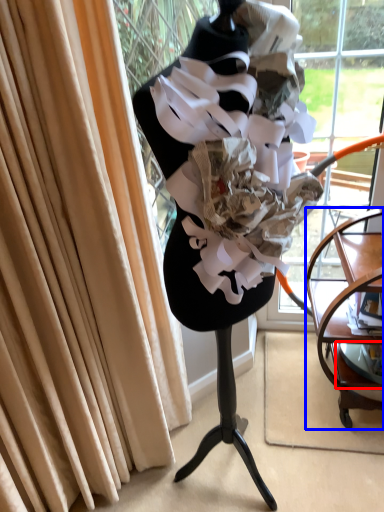
Question: Which point is further to the camera, shelf (highlighted by a red box) or furniture (highlighted by a blue box)?

Choices:
 (A) shelf
 (B) furniture

Answer: (A)